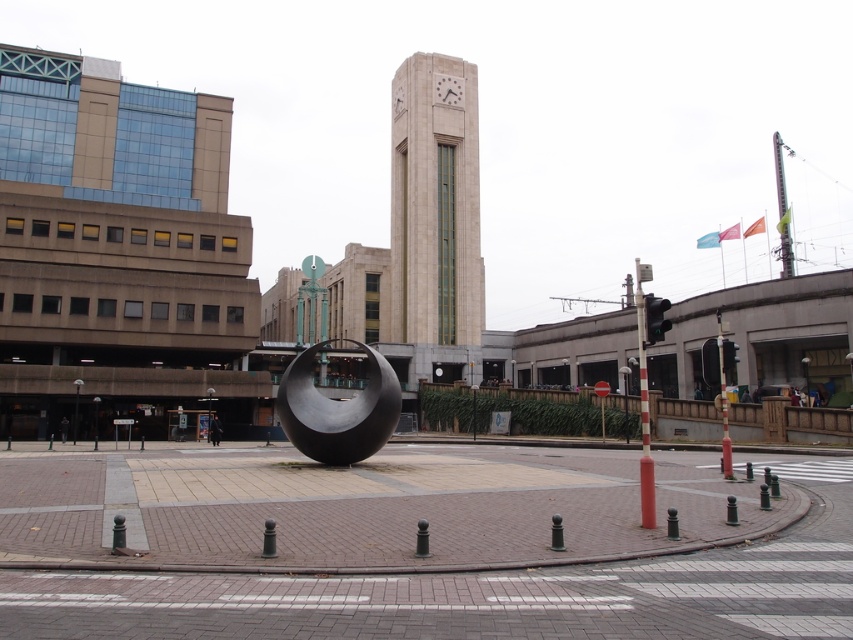
You are a delivery person with a cart that is 2 meters wide. You need to move your cart from the beige stone clock tower at center to the polished metal sphere at center. Can you fit through the path between them?

The distance between the beige stone clock tower at center and the polished metal sphere at center is 23.63 meters, so yes, the cart can fit through the path between them since the distance is much wider than the cart.